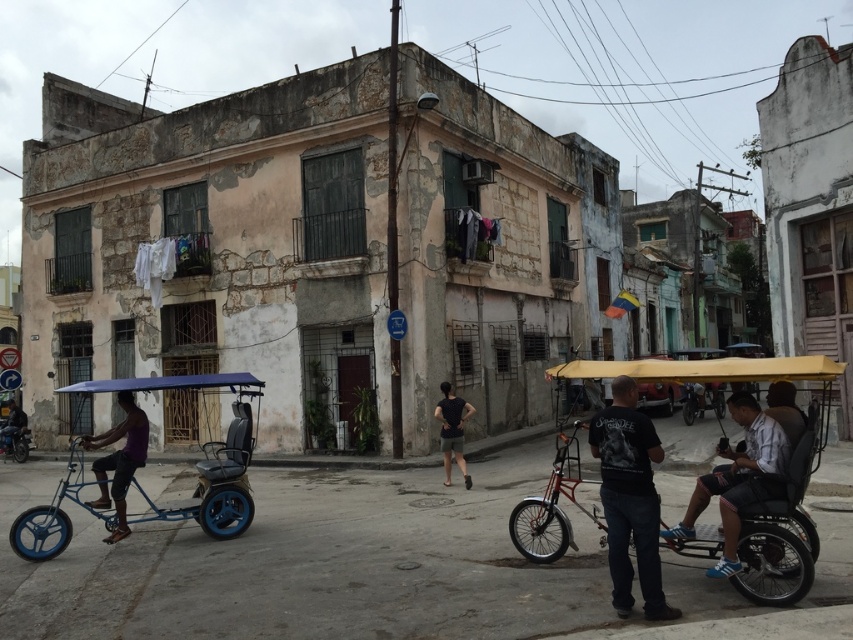
Question: Which point is closer to the camera?

Choices:
 (A) (44, 531)
 (B) (24, 424)

Answer: (A)

Question: From the image, what is the correct spatial relationship of black matte t-shirt at center in relation to shiny metallic bicycle at center?

Choices:
 (A) left
 (B) right

Answer: (A)

Question: Estimate the real-world distances between objects in this image. Which object is closer to the white cotton shirt at lower right?

Choices:
 (A) dark blue fabric bicycle at lower left
 (B) black matte t-shirt at center
 (C) blue matte tricycle at left
 (D) purple fabric pedicab at left

Answer: (B)

Question: Does blue matte tricycle at left appear over shiny metallic bicycle at center?

Choices:
 (A) no
 (B) yes

Answer: (B)

Question: Does purple fabric pedicab at left appear under dark blue fabric bicycle at lower left?

Choices:
 (A) no
 (B) yes

Answer: (A)

Question: Which of these objects is positioned farthest from the dark blue fabric bicycle at lower left?

Choices:
 (A) purple fabric pedicab at left
 (B) white cotton shirt at lower right
 (C) shiny metallic bicycle at center

Answer: (B)